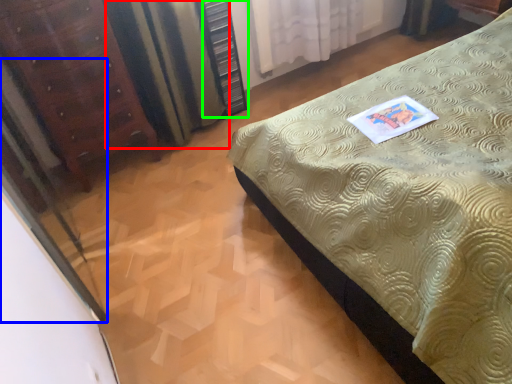
Question: Which object is the farthest from curtain (highlighted by a red box)? Choose among these: screen door (highlighted by a blue box) or dresser (highlighted by a green box).

Choices:
 (A) screen door
 (B) dresser

Answer: (A)